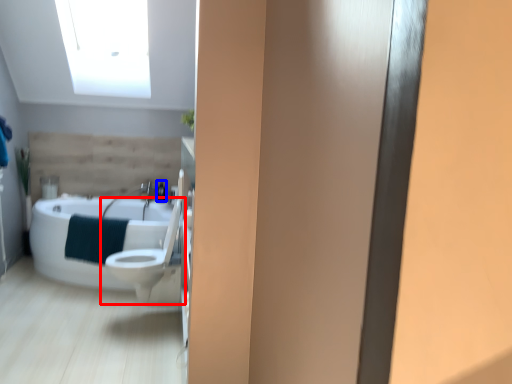
Question: Among these objects, which one is nearest to the camera, toilet (highlighted by a red box) or toiletry (highlighted by a blue box)?

Choices:
 (A) toilet
 (B) toiletry

Answer: (A)